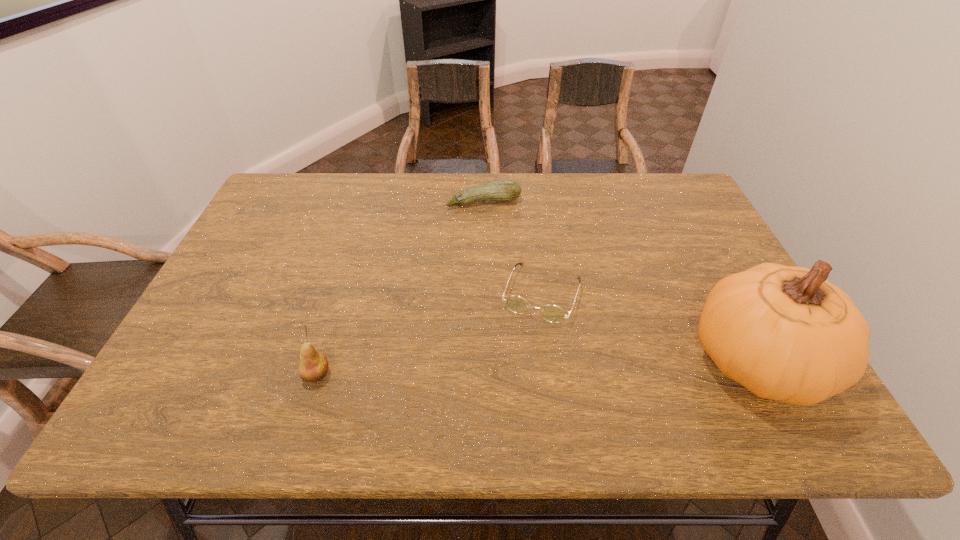
Where is `vacant space situated 0.150m on the lenses of the shortest object`? This screenshot has width=960, height=540. vacant space situated 0.150m on the lenses of the shortest object is located at coordinates point(514,376).

Where is `vacant position located on the lenses of the shortest object`? vacant position located on the lenses of the shortest object is located at coordinates (518, 361).

This screenshot has height=540, width=960. In order to click on object at the far edge in this screenshot , I will do `click(499, 190)`.

Find the location of `pear present at the near edge`. pear present at the near edge is located at coordinates (313, 366).

Where is `pumpkin located in the near edge section of the desktop`? pumpkin located in the near edge section of the desktop is located at coordinates (785, 333).

The width and height of the screenshot is (960, 540). Find the location of `object present at the right edge`. object present at the right edge is located at coordinates (785, 333).

Identify the location of object present at the near right corner. (785, 333).

The width and height of the screenshot is (960, 540). Find the location of `free location at the far edge of the desktop`. free location at the far edge of the desktop is located at coordinates (615, 197).

In the image, there is a desktop. Where is `free space at the near edge`? The height and width of the screenshot is (540, 960). free space at the near edge is located at coordinates (607, 386).

Find the location of a particular element. Image resolution: width=960 pixels, height=540 pixels. vacant space at the left edge is located at coordinates (265, 284).